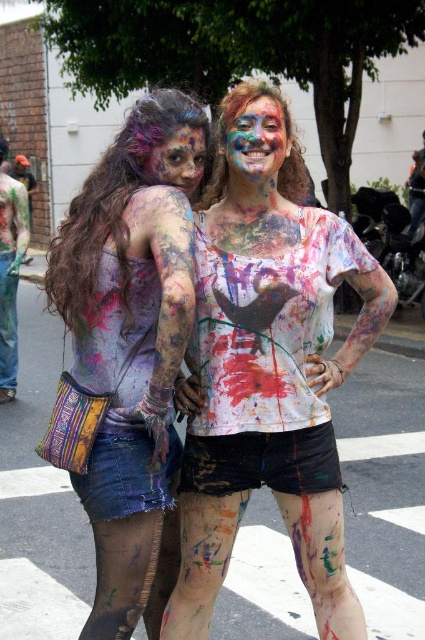
You are a photographer trying to capture a closeup of both the painted fabric skirt at center and the painted skin face at center. Since you can only focus on one subject at a time, which one should you choose to ensure the entire subject fits in the frame without cropping?

The painted fabric skirt at center is wider than the painted skin face at center, so you should focus on the painted fabric skirt at center to ensure it fits entirely in the frame without cropping.

You are a photographer at a paint festival. You want to take a closeup photo of the painted skin face at center. Your camera has a minimum focusing distance of 2 meters. Can you take the photo without moving closer?

→ The painted skin face at center is 2.71 meters away from the camera, which is beyond the minimum focusing distance of 2 meters. Therefore, you can take the closeup photo without moving closer.

You are standing 10 feet away from the image. Is the point at coordinates point(269, 124) closer to you than your current position?

The distance of point(269, 124) from viewer is 9.02 feet, so yes, the point is closer to you than your current position which is 10 feet away.